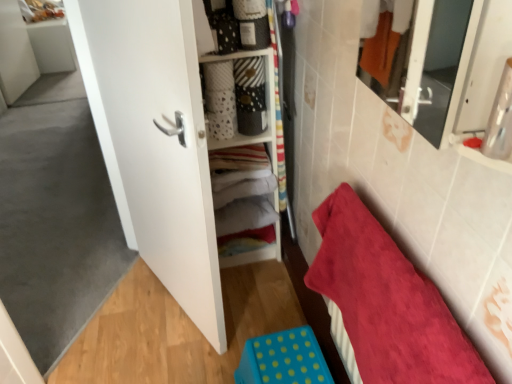
Question: Is red plush towel at lower right next to matte white cabinet at center?

Choices:
 (A) no
 (B) yes

Answer: (A)

Question: Is red plush towel at lower right not near matte white cabinet at center?

Choices:
 (A) yes
 (B) no

Answer: (B)

Question: Can we say red plush towel at lower right lies outside matte white cabinet at center?

Choices:
 (A) no
 (B) yes

Answer: (B)

Question: Is red plush towel at lower right at the right side of matte white cabinet at center?

Choices:
 (A) yes
 (B) no

Answer: (A)

Question: Is the position of red plush towel at lower right more distant than that of matte white cabinet at center?

Choices:
 (A) yes
 (B) no

Answer: (B)

Question: From the image's perspective, is blue polka dot plastic step stool at lower center above or below matte white cabinet at center?

Choices:
 (A) above
 (B) below

Answer: (B)

Question: Is blue polka dot plastic step stool at lower center situated inside matte white cabinet at center or outside?

Choices:
 (A) inside
 (B) outside

Answer: (B)

Question: From their relative heights in the image, would you say blue polka dot plastic step stool at lower center is taller or shorter than matte white cabinet at center?

Choices:
 (A) short
 (B) tall

Answer: (A)

Question: Is blue polka dot plastic step stool at lower center wider or thinner than matte white cabinet at center?

Choices:
 (A) thin
 (B) wide

Answer: (B)

Question: Do you think red plush towel at lower right is within blue polka dot plastic step stool at lower center, or outside of it?

Choices:
 (A) outside
 (B) inside

Answer: (A)

Question: In terms of width, does red plush towel at lower right look wider or thinner when compared to blue polka dot plastic step stool at lower center?

Choices:
 (A) thin
 (B) wide

Answer: (A)

Question: Is red plush towel at lower right in front of or behind blue polka dot plastic step stool at lower center in the image?

Choices:
 (A) behind
 (B) front

Answer: (B)

Question: Is red plush towel at lower right bigger or smaller than blue polka dot plastic step stool at lower center?

Choices:
 (A) small
 (B) big

Answer: (B)

Question: From a real-world perspective, is white soft fabric at center physically located above or below red plush towel at lower right?

Choices:
 (A) above
 (B) below

Answer: (A)

Question: Is point (229, 225) positioned closer to the camera than point (339, 225)?

Choices:
 (A) closer
 (B) farther

Answer: (B)